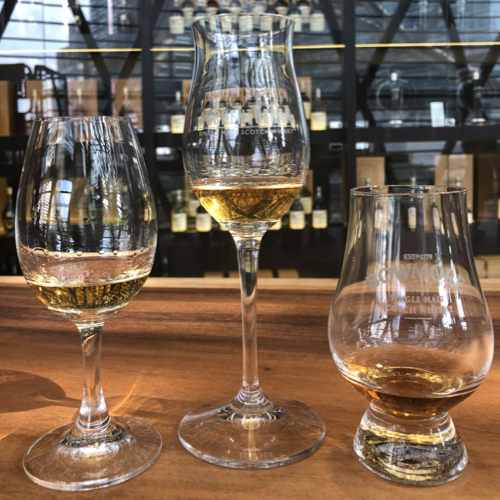
At what (x,y) coordinates should I click in order to perform the action: click on tall glass. Please return your answer as a coordinate pair (x, y). The image size is (500, 500). Looking at the image, I should click on coord(247,160).